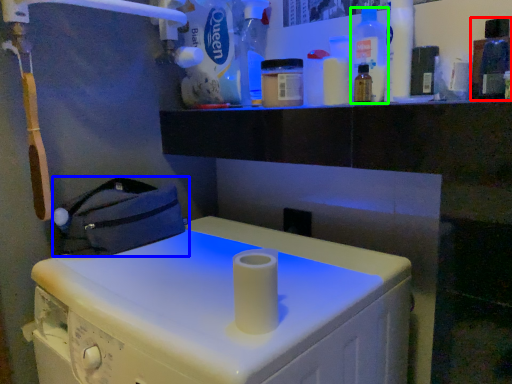
Question: Considering the real-world distances, which object is farthest from bottle (highlighted by a red box)? bag (highlighted by a blue box) or bottle (highlighted by a green box)?

Choices:
 (A) bag
 (B) bottle

Answer: (A)